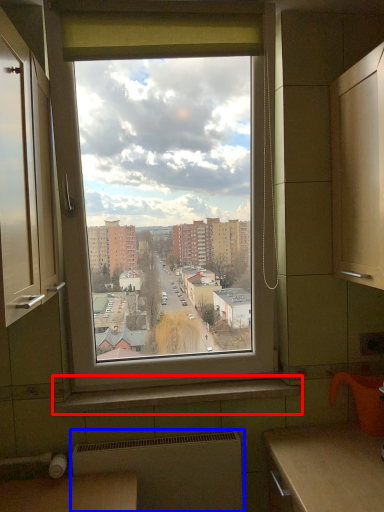
Question: Which point is further to the camera, window sill (highlighted by a red box) or radiator (highlighted by a blue box)?

Choices:
 (A) window sill
 (B) radiator

Answer: (A)